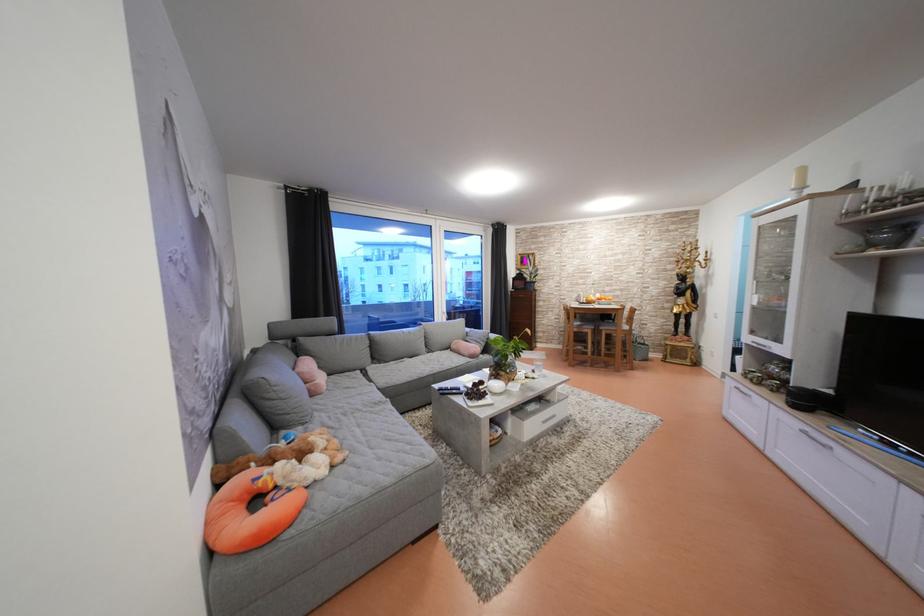
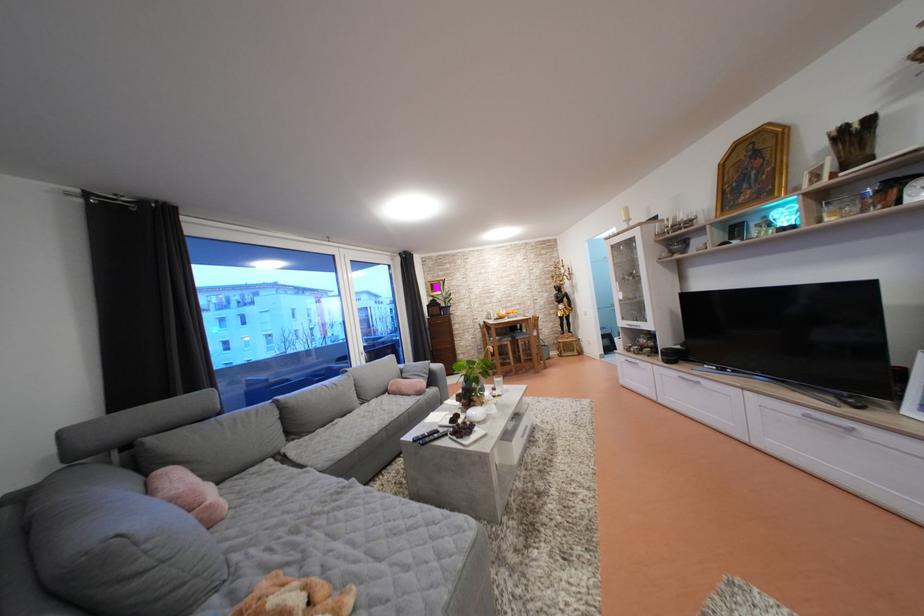
Locate, in the second image, the point that corresponds to point 760,338 in the first image.

(629, 323)